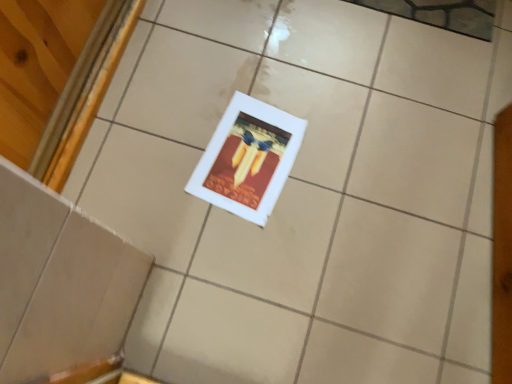
Where is `free space in front of white matte picture frame at center`? The image size is (512, 384). free space in front of white matte picture frame at center is located at coordinates (238, 255).